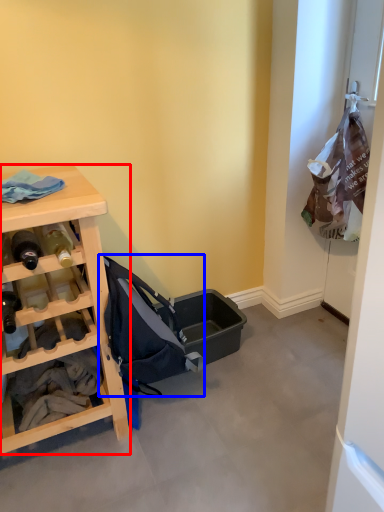
Question: Which object appears closest to the camera in this image, desk (highlighted by a red box) or baby carriage (highlighted by a blue box)?

Choices:
 (A) desk
 (B) baby carriage

Answer: (A)